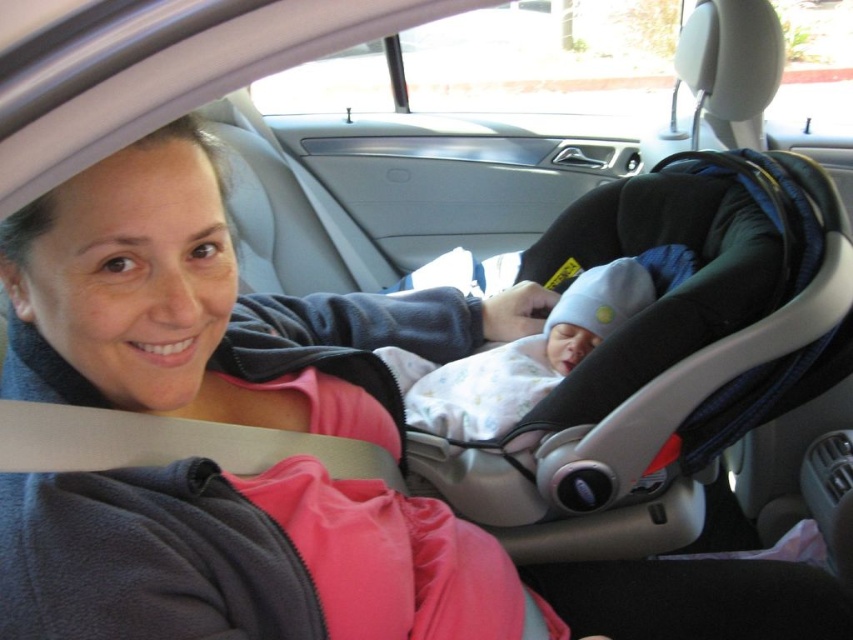
In the scene shown: Can you confirm if black textured car seat at center is positioned to the right of white soft fabric baby at center?

Indeed, black textured car seat at center is positioned on the right side of white soft fabric baby at center.

You are a GUI agent. You are given a task and a screenshot of the screen. Output one action in this format:
    pyautogui.click(x=<x>, y=<y>)
    Task: Click on the black textured car seat at center
    This screenshot has width=853, height=640.
    Given the screenshot: What is the action you would take?
    pyautogui.click(x=653, y=371)